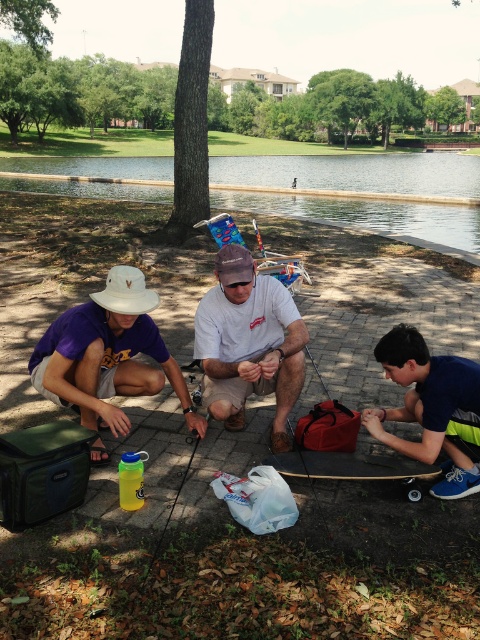
Which is more to the right, purple matte hat at center or white matte cowboy hat at lower left?

white matte cowboy hat at lower left

In the scene shown: Is purple matte hat at center behind white matte cowboy hat at lower left?

That is True.

Where is `purple matte hat at center`? The width and height of the screenshot is (480, 640). purple matte hat at center is located at coordinates (108, 355).

Who is taller, clear glass water at center or purple matte hat at center?

With more height is clear glass water at center.

Can you confirm if clear glass water at center is positioned to the left of purple matte hat at center?

Incorrect, clear glass water at center is not on the left side of purple matte hat at center.

You are a GUI agent. You are given a task and a screenshot of the screen. Output one action in this format:
    pyautogui.click(x=<x>, y=<y>)
    Task: Click on the clear glass water at center
    This screenshot has width=480, height=640.
    Given the screenshot: What is the action you would take?
    pyautogui.click(x=360, y=189)

Is point (109, 188) positioned after point (226, 275)?

Yes, it is behind point (226, 275).

Who is more distant from viewer, (399, 186) or (228, 266)?

The point (399, 186) is more distant.

Find the location of a particular element. Image resolution: width=480 pixels, height=640 pixels. clear glass water at center is located at coordinates (360, 189).